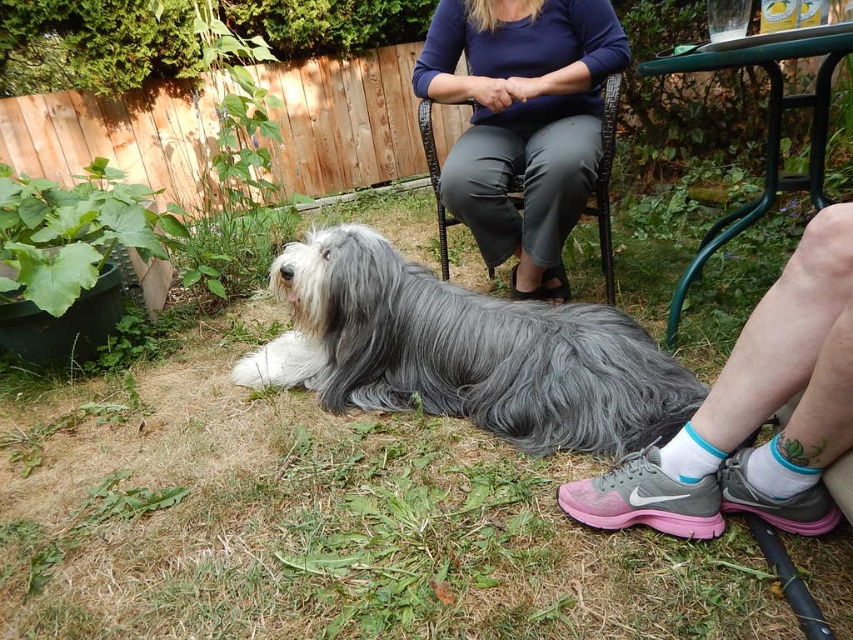
Question: Which point appears closest to the camera in this image?

Choices:
 (A) (706, 472)
 (B) (419, 112)
 (C) (575, 404)

Answer: (A)

Question: Among these points, which one is nearest to the camera?

Choices:
 (A) (608, 232)
 (B) (566, 490)
 (C) (567, 417)

Answer: (B)

Question: Is gray fluffy dog at center bigger than woven wicker chair at center?

Choices:
 (A) yes
 (B) no

Answer: (A)

Question: Among these objects, which one is nearest to the camera?

Choices:
 (A) woven wicker chair at center
 (B) gray fluffy dog at center

Answer: (B)

Question: Does gray fluffy dog at center appear on the left side of pink mesh sneakers at lower right?

Choices:
 (A) no
 (B) yes

Answer: (B)

Question: Is gray fluffy dog at center below pink mesh sneakers at lower right?

Choices:
 (A) yes
 (B) no

Answer: (B)